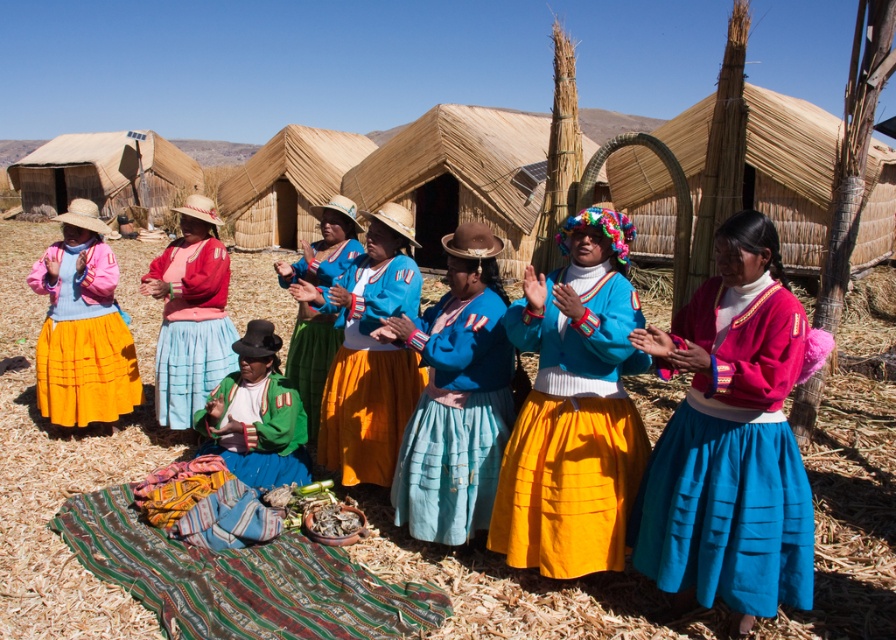
Is matte pink sweater at center to the right of blue cotton skirt at center from the viewer's perspective?

Indeed, matte pink sweater at center is positioned on the right side of blue cotton skirt at center.

Does matte pink sweater at center come in front of blue cotton skirt at center?

Yes, it is in front of blue cotton skirt at center.

Identify the location of matte pink sweater at center. (731, 464).

Consider the image. Does matte blue skirt at center have a lesser width compared to blue cotton blouse at center?

Correct, matte blue skirt at center's width is less than blue cotton blouse at center's.

Is matte blue skirt at center below blue cotton blouse at center?

Correct, matte blue skirt at center is located below blue cotton blouse at center.

Is point (224, 349) closer to camera compared to point (346, 237)?

No, it is behind (346, 237).

Where is `matte blue skirt at center`? matte blue skirt at center is located at coordinates (191, 328).

Does multicolored woven cloth at lower center come behind green fabric at center?

No, multicolored woven cloth at lower center is in front of green fabric at center.

Is multicolored woven cloth at lower center closer to camera compared to green fabric at center?

That is True.

Which is behind, point (309, 557) or point (202, 448)?

Positioned behind is point (202, 448).

In order to click on multicolored woven cloth at lower center in this screenshot , I will do `click(240, 577)`.